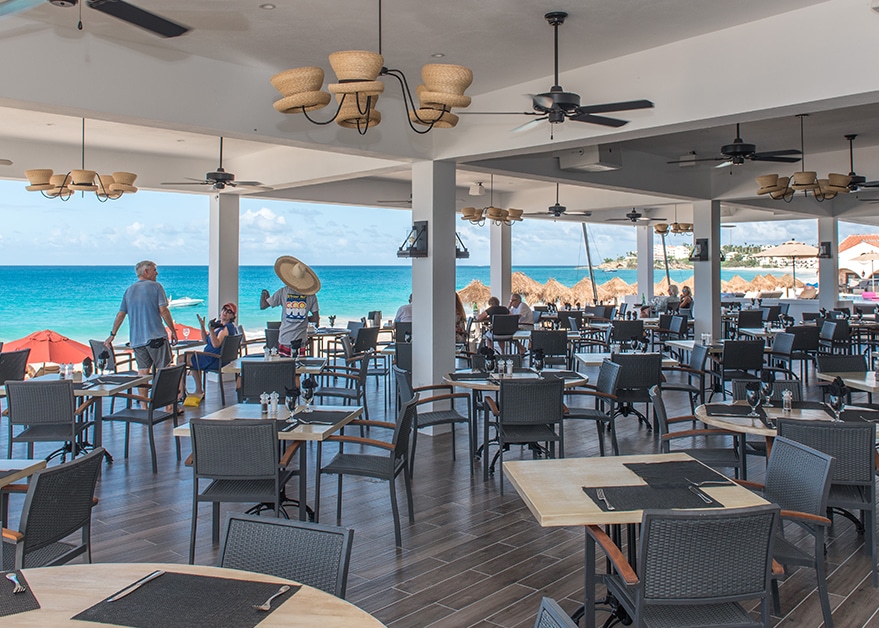
I want to click on chair, so click(x=52, y=411).